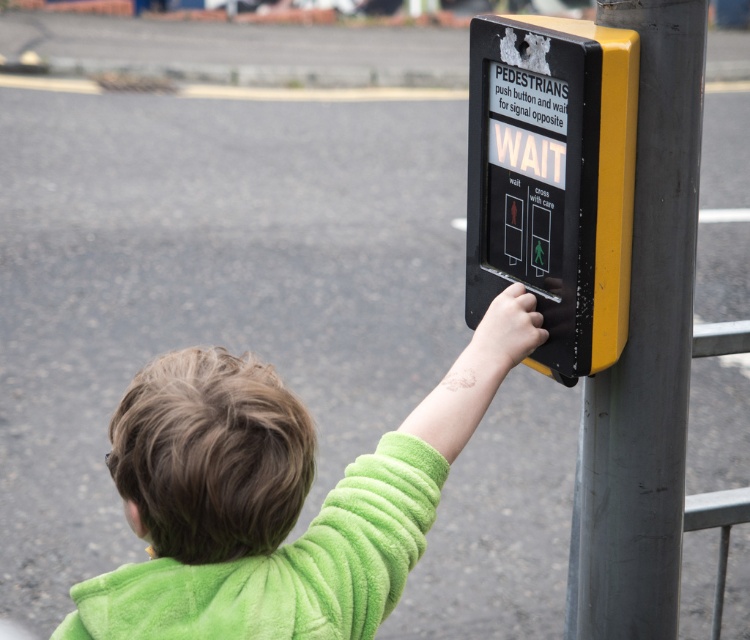
Question: Does green fuzzy sweater at center have a larger size compared to black plastic pedestrian signal at center?

Choices:
 (A) yes
 (B) no

Answer: (A)

Question: Is green fuzzy sweater at center behind green fuzzy sweatshirt at upper right?

Choices:
 (A) no
 (B) yes

Answer: (A)

Question: Which point is farther to the camera?

Choices:
 (A) (693, 284)
 (B) (398, 451)

Answer: (A)

Question: Among these points, which one is nearest to the camera?

Choices:
 (A) (490, 352)
 (B) (318, 589)

Answer: (B)

Question: Which point appears farthest from the camera in this image?

Choices:
 (A) (516, 138)
 (B) (388, 522)
 (C) (576, 627)

Answer: (C)

Question: Does green fuzzy sweater at center have a lesser width compared to metallic gray pole at right?

Choices:
 (A) yes
 (B) no

Answer: (B)